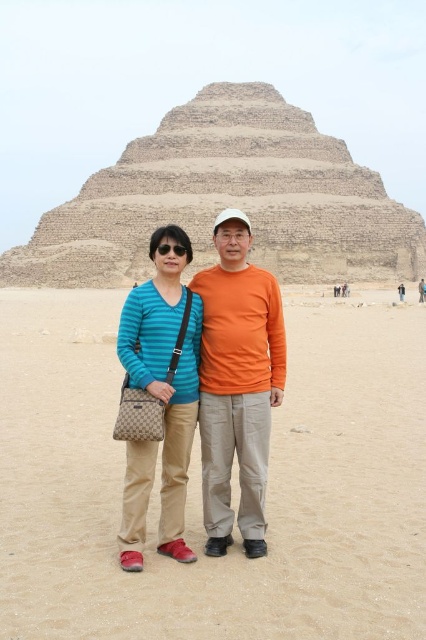
Question: Can you confirm if beige sand at center is thinner than matte blue striped shirt at center?

Choices:
 (A) no
 (B) yes

Answer: (A)

Question: Which point is farther from the camera taking this photo?

Choices:
 (A) (176, 278)
 (B) (304, 358)

Answer: (B)

Question: Among these points, which one is farthest from the camera?

Choices:
 (A) click(x=155, y=445)
 (B) click(x=376, y=339)
 (C) click(x=244, y=173)
 (D) click(x=216, y=396)

Answer: (C)

Question: Is beige sand at center to the right of matte blue striped shirt at center from the viewer's perspective?

Choices:
 (A) no
 (B) yes

Answer: (B)

Question: Which of the following is the closest to the observer?

Choices:
 (A) (103, 214)
 (B) (386, 493)
 (C) (135, 529)

Answer: (C)

Question: Is sandstone pyramid at center below matte blue striped shirt at center?

Choices:
 (A) yes
 (B) no

Answer: (B)